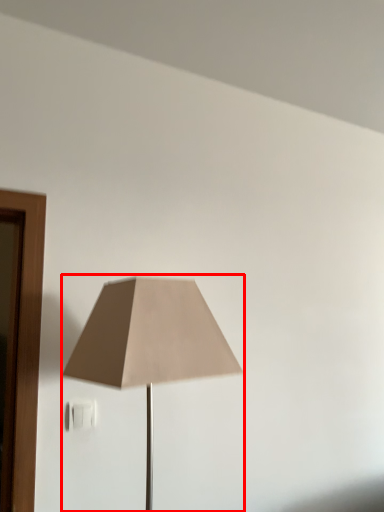
Question: From the image's perspective, considering the relative positions of lamp (annotated by the red box) and electric outlet in the image provided, where is lamp (annotated by the red box) located with respect to the staircase?

Choices:
 (A) above
 (B) below

Answer: (A)